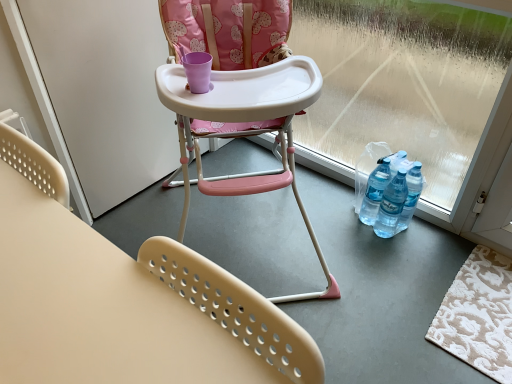
You are a GUI agent. You are given a task and a screenshot of the screen. Output one action in this format:
    pyautogui.click(x=<x>, y=<y>)
    Task: Click on the vacant space underneath pink plastic highchair at center, the 2th chair when ordered from front to back (from a real-world perspective)
    The image size is (512, 384).
    Given the screenshot: What is the action you would take?
    pyautogui.click(x=248, y=234)